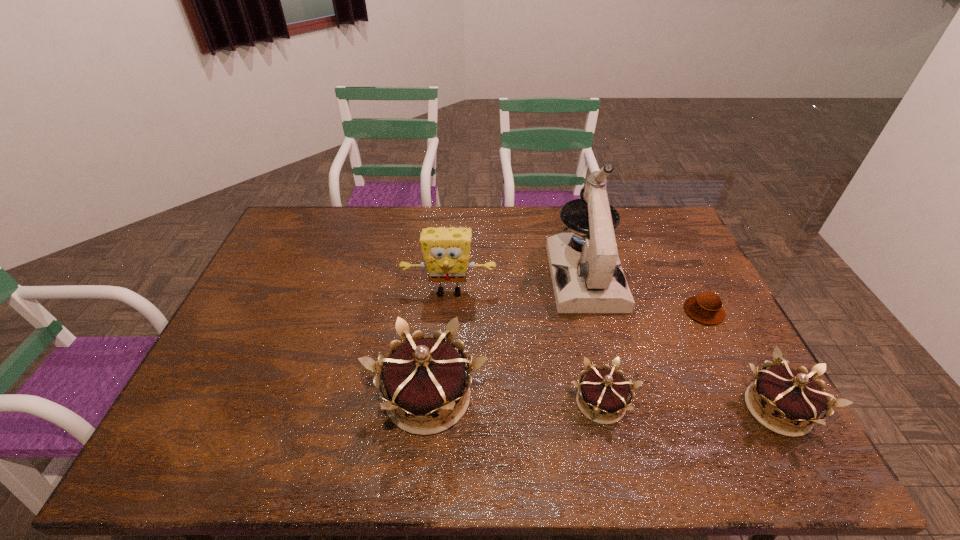
What are the coordinates of `blank area located 0.150m on the left of the rightmost crown` in the screenshot? It's located at (679, 409).

Where is `free region located 0.380m on the face of the sponge`? This screenshot has height=540, width=960. free region located 0.380m on the face of the sponge is located at coordinates (440, 418).

Find the location of `vacant space located at the eyepiece of the tallest object`. vacant space located at the eyepiece of the tallest object is located at coordinates (604, 350).

At what (x,y) coordinates should I click in order to perform the action: click on free spot located on the back of the muffin. Please return your answer as a coordinate pair (x, y). This screenshot has height=540, width=960. Looking at the image, I should click on (662, 228).

Find the location of a particular element. object that is positioned at the far edge is located at coordinates (592, 281).

The image size is (960, 540). What are the coordinates of `crown present at the right edge` in the screenshot? It's located at (796, 401).

The width and height of the screenshot is (960, 540). Identify the location of muffin that is at the right edge. (706, 307).

Identify the location of object present at the near right corner. (796, 401).

Locate an element on the screen. This screenshot has height=540, width=960. vacant space at the far edge of the desktop is located at coordinates (439, 224).

At what (x,y) coordinates should I click in order to perform the action: click on vacant space at the near edge of the desktop. Please return your answer as a coordinate pair (x, y). The image size is (960, 540). Looking at the image, I should click on (551, 415).